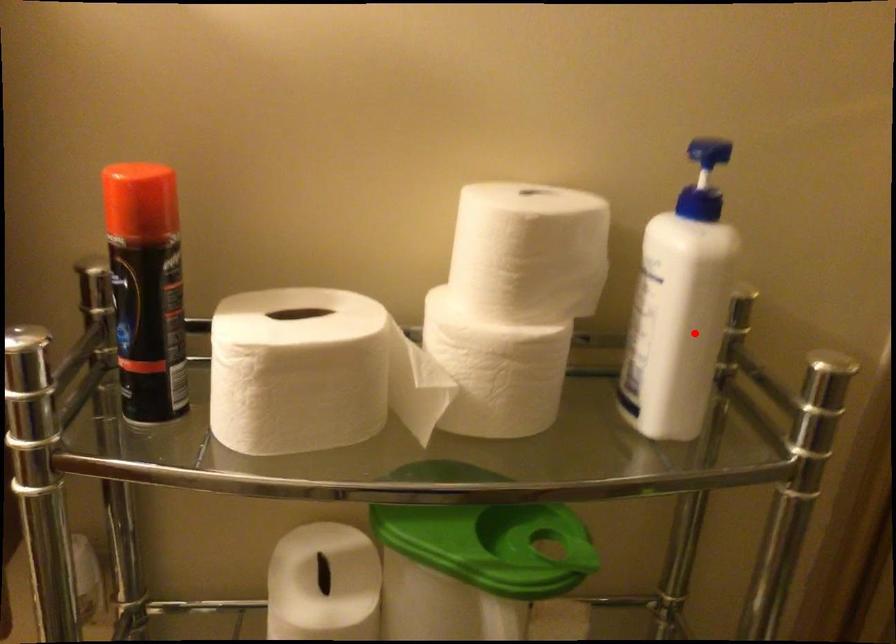
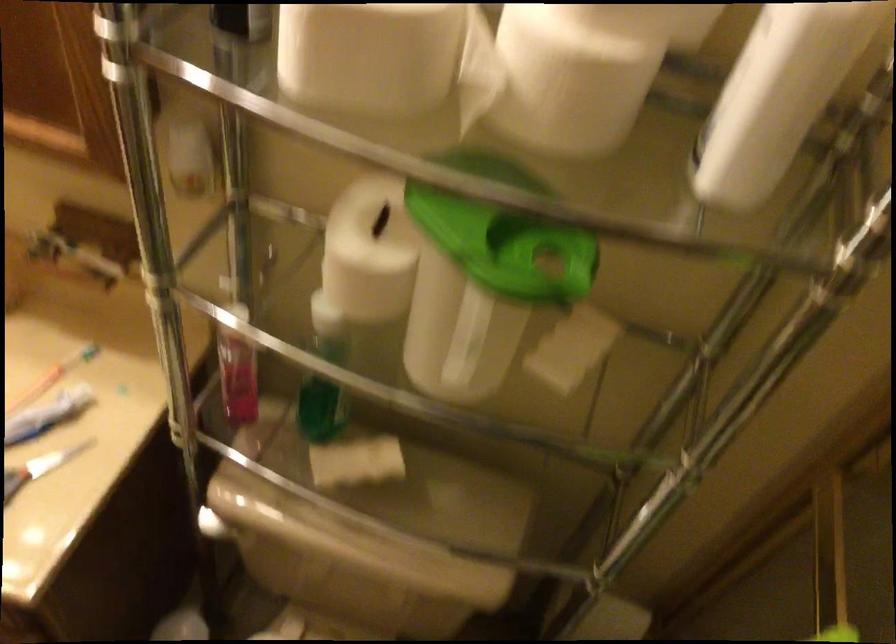
Question: I am providing you with two images of the same scene from different viewpoints. Image1 has a red point marked. In image2, the corresponding 3D location appears at what relative position? Reply with the corresponding letter.

Choices:
 (A) Closer
 (B) Farther

Answer: (A)